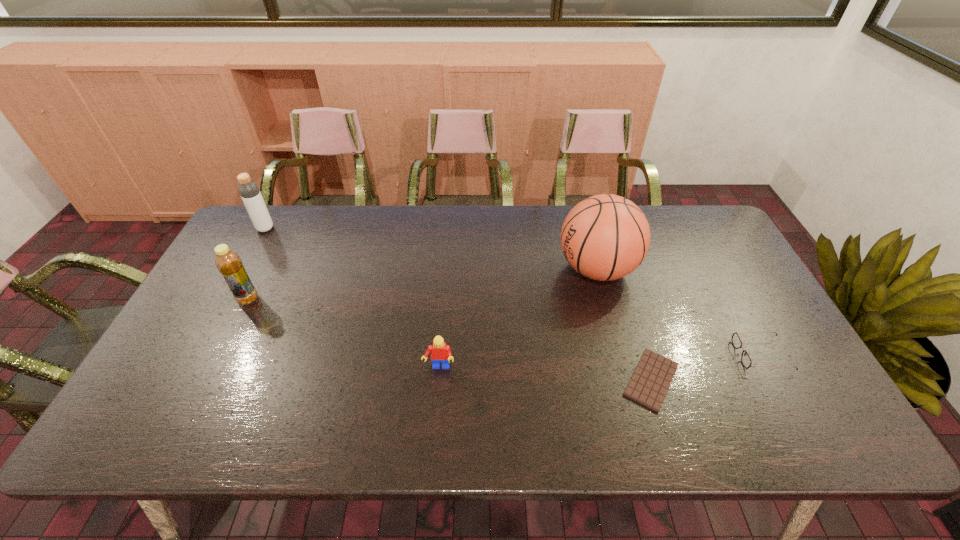
The width and height of the screenshot is (960, 540). In order to click on basketball that is at the far edge in this screenshot , I will do `click(605, 237)`.

Locate an element on the screen. This screenshot has width=960, height=540. bottle that is at the far edge is located at coordinates (249, 191).

Identify the location of object present at the near edge. (649, 384).

Locate an element on the screen. This screenshot has width=960, height=540. object that is at the right edge is located at coordinates (736, 341).

This screenshot has width=960, height=540. I want to click on object located at the far left corner, so click(249, 191).

Identify the location of vacant space at the far edge of the desktop. (661, 232).

The height and width of the screenshot is (540, 960). What are the coordinates of `free space at the near edge of the desktop` in the screenshot? It's located at (689, 430).

At what (x,y) coordinates should I click in order to perform the action: click on free region at the right edge of the desktop. Please return your answer as a coordinate pair (x, y). This screenshot has height=540, width=960. Looking at the image, I should click on (703, 273).

This screenshot has width=960, height=540. I want to click on free region at the near right corner of the desktop, so click(x=783, y=413).

Where is `free space that is in between the right bottle and the shortest object`? free space that is in between the right bottle and the shortest object is located at coordinates (450, 340).